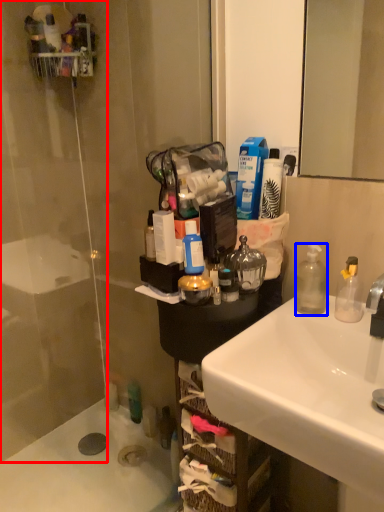
Question: Which of the following is the farthest to the observer, glass door (highlighted by a red box) or bottle (highlighted by a blue box)?

Choices:
 (A) glass door
 (B) bottle

Answer: (A)